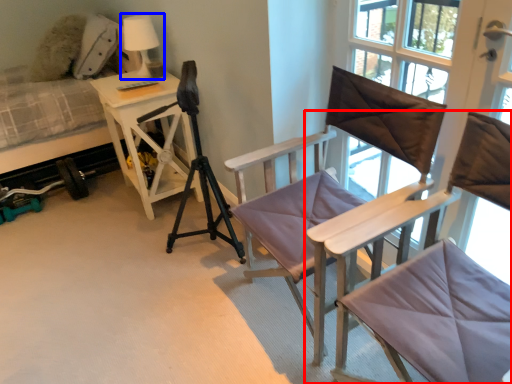
Question: Which point is further to the camera, chair (highlighted by a red box) or table lamp (highlighted by a blue box)?

Choices:
 (A) chair
 (B) table lamp

Answer: (B)